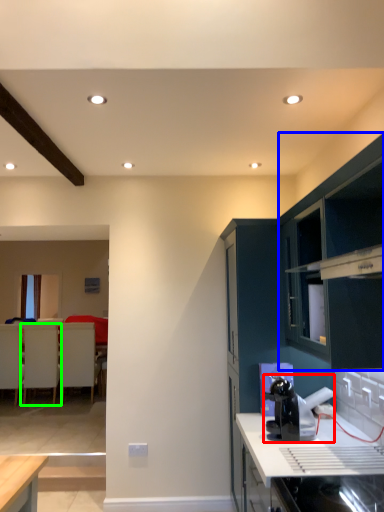
Question: Which object is positioned farthest from appliance (highlighted by a red box)? Select from cabinetry (highlighted by a blue box) and armchair (highlighted by a green box).

Choices:
 (A) cabinetry
 (B) armchair

Answer: (B)